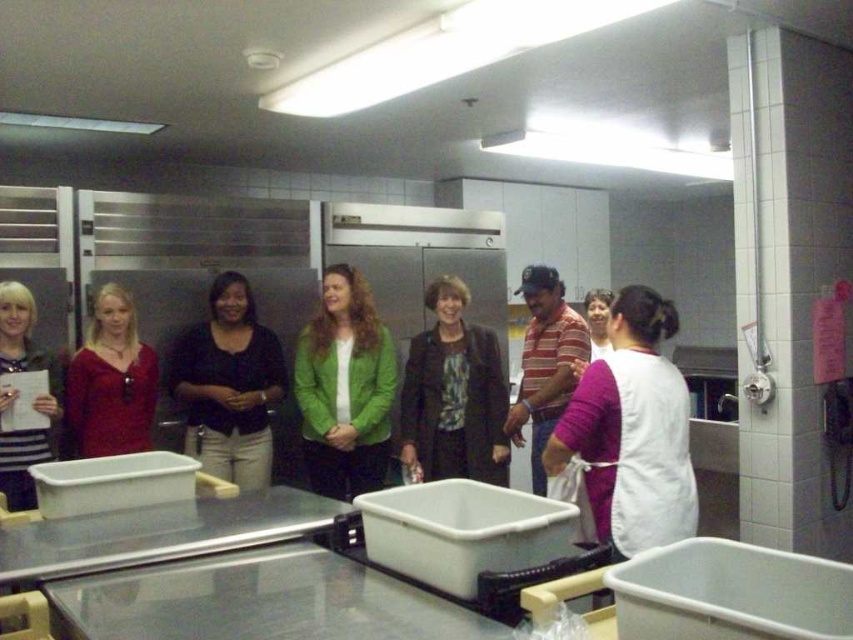
Is matte red sweater at center to the right of striped cotton shirt at center from the viewer's perspective?

No, matte red sweater at center is not to the right of striped cotton shirt at center.

Is matte red sweater at center shorter than striped cotton shirt at center?

Yes, matte red sweater at center is shorter than striped cotton shirt at center.

Find the location of `matte red sweater at center`. matte red sweater at center is located at coordinates (109, 381).

Locate an element on the screen. matte red sweater at center is located at coordinates (109, 381).

Between green matte blazer at center and striped cotton shirt at center, which one is positioned lower?

striped cotton shirt at center is lower down.

Between green matte blazer at center and striped cotton shirt at center, which one appears on the right side from the viewer's perspective?

striped cotton shirt at center

Between point (364, 426) and point (543, 312), which one is positioned behind?

Positioned behind is point (543, 312).

Identify the location of green matte blazer at center. This screenshot has height=640, width=853. (344, 388).

Describe the element at coordinates (344, 388) in the screenshot. I see `green matte blazer at center` at that location.

Is point (389, 344) positioned in front of point (426, 301)?

That is True.

This screenshot has height=640, width=853. What are the coordinates of `green matte blazer at center` in the screenshot? It's located at (344, 388).